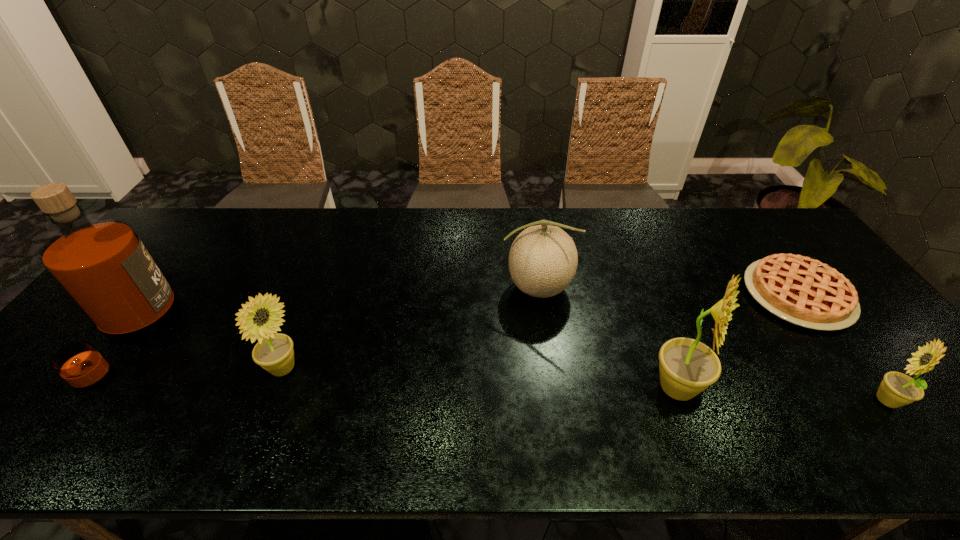
This screenshot has height=540, width=960. In order to click on sunflower identified as the second closest to the pie in this screenshot , I will do [x=687, y=367].